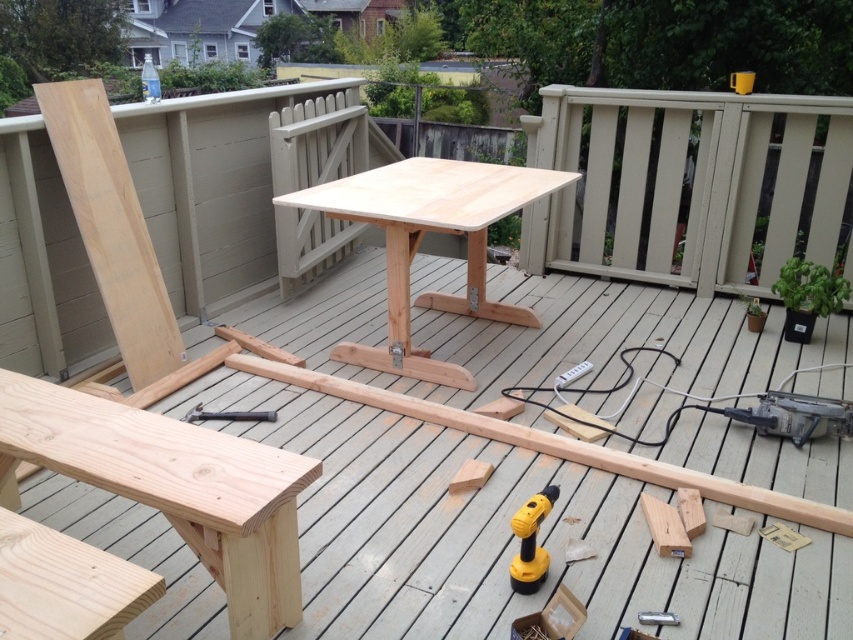
Question: Which object is farther from the camera taking this photo?

Choices:
 (A) natural wood table at center
 (B) yellow plastic drill at lower center

Answer: (A)

Question: Does natural wood bench at lower left have a lesser width compared to silver metallic hammer at center?

Choices:
 (A) yes
 (B) no

Answer: (B)

Question: Which of the following is the farthest from the observer?

Choices:
 (A) yellow plastic drill at lower center
 (B) silver metallic hammer at center
 (C) natural wood table at center
 (D) natural wood bench at lower left

Answer: (B)

Question: Is the position of natural wood bench at lower left more distant than that of natural wood table at center?

Choices:
 (A) yes
 (B) no

Answer: (B)

Question: Does yellow plastic drill at lower center appear on the right side of silver metallic hammer at center?

Choices:
 (A) no
 (B) yes

Answer: (B)

Question: Which of the following is the closest to the observer?

Choices:
 (A) (245, 524)
 (B) (199, 404)
 (C) (538, 522)
 (D) (392, 241)

Answer: (A)